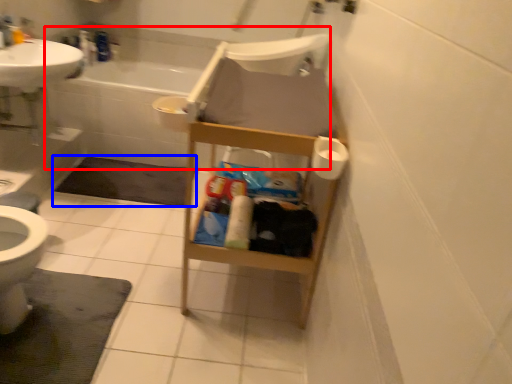
Question: Which object appears farthest to the camera in this image, bath (highlighted by a red box) or bath mat (highlighted by a blue box)?

Choices:
 (A) bath
 (B) bath mat

Answer: (A)